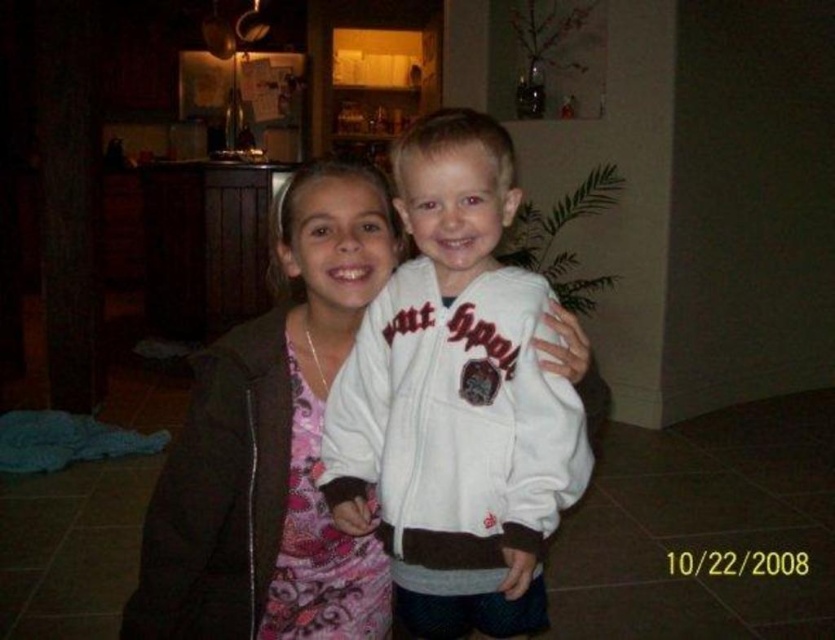
You are trying to place a small sticker on one of two points in the image. The first point is at coordinates point (453, 348) and the second is at point (235, 397). If you want to place the sticker closer to the children, which point should you choose?

Point (453, 348) is in front of point (235, 397), so placing the sticker at point (453, 348) would be closer to the children.

You are a tailor measuring jackets in a store. You have a customer who needs a jacket that is not too bulky. Looking at the image, which of the two jackets, the white fleece jacket at center or the matte brown robe at center, would you recommend based on their thickness?

The white fleece jacket at center is thinner than the matte brown robe at center, so I would recommend the white fleece jacket at center as it is less bulky.

You are a delivery person who needs to place a small package on the floor. The package must be placed exactly at point [456,400]. However, there is an object at that location. What is the object blocking the delivery?

The white fleece jacket at center is located at point [456,400], so it is blocking the delivery.